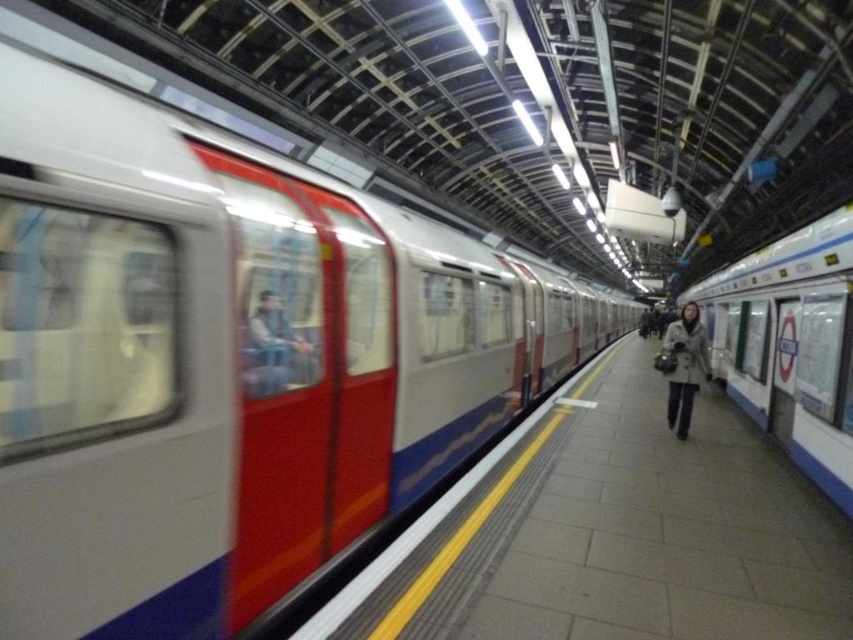
Who is taller, smooth concrete platform at center or light brown textured coat at center?

light brown textured coat at center is taller.

The height and width of the screenshot is (640, 853). What do you see at coordinates (611, 532) in the screenshot? I see `smooth concrete platform at center` at bounding box center [611, 532].

The width and height of the screenshot is (853, 640). I want to click on smooth concrete platform at center, so point(611,532).

Who is shorter, white glossy train at right or light brown textured coat at center?

Standing shorter between the two is light brown textured coat at center.

Who is higher up, white glossy train at right or light brown textured coat at center?

white glossy train at right

Image resolution: width=853 pixels, height=640 pixels. In order to click on white glossy train at right in this screenshot , I will do `click(791, 344)`.

Is point (483, 579) more distant than point (843, 260)?

No, it is in front of (843, 260).

Between point (606, 365) and point (814, 268), which one is positioned in front?

Point (814, 268) is more forward.

Where is `smooth concrete platform at center`? The height and width of the screenshot is (640, 853). smooth concrete platform at center is located at coordinates (611, 532).